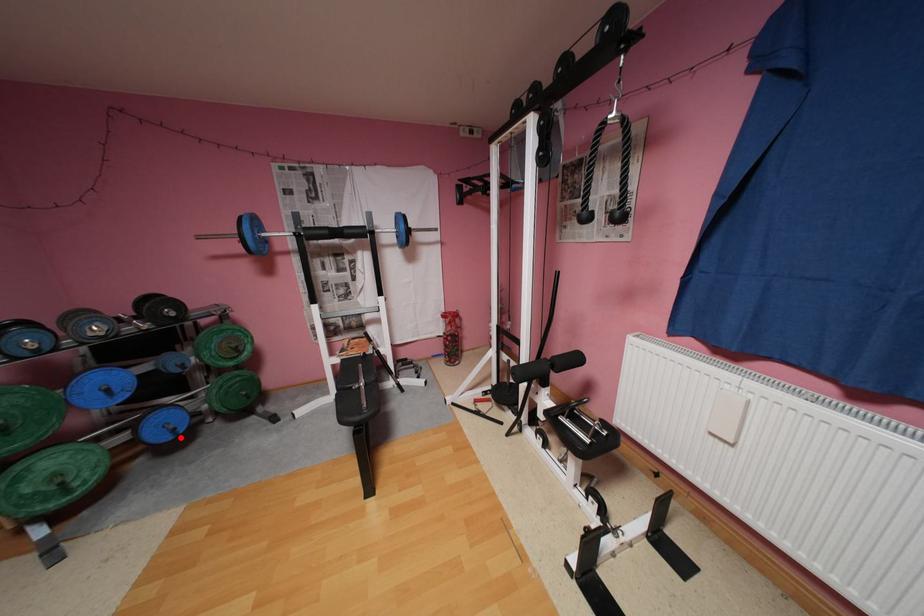
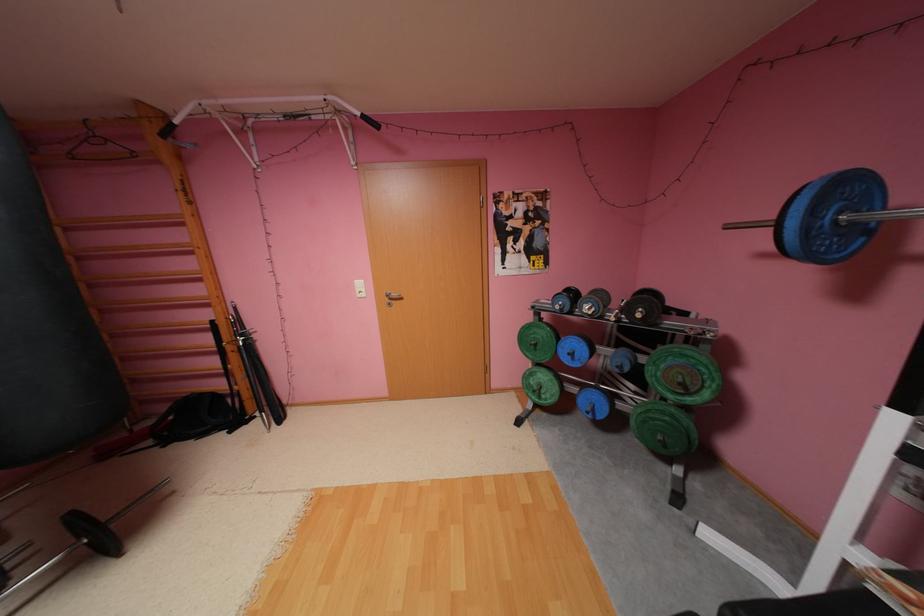
Question: I am providing you with two images of the same scene from different viewpoints. In image1, a red point is highlighted. Considering the same 3D point in image2, which of the following is correct?

Choices:
 (A) It is closer
 (B) It is farther

Answer: (B)